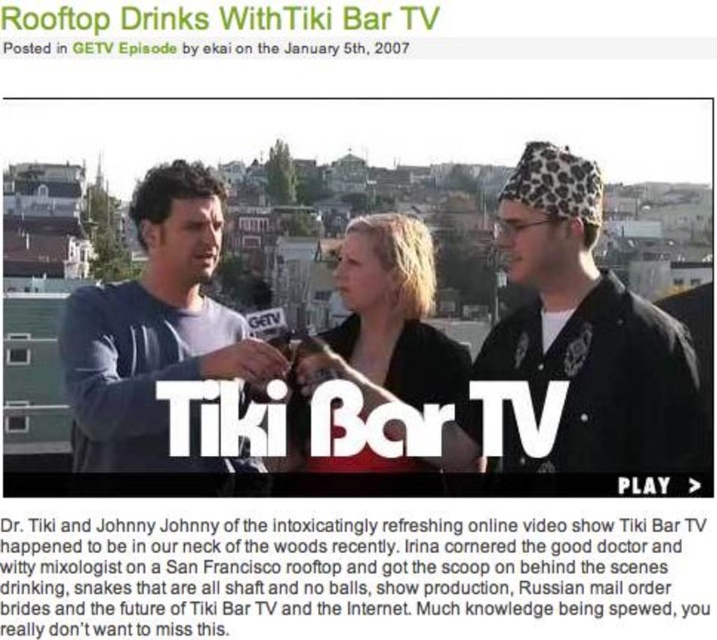
You are a photographer trying to capture a clear shot of the black paper text at center and the blonde hair at center. Which object should you zoom in on to ensure both are visible in the frame?

The black paper text at center is smaller than the blonde hair at center, so you should zoom in on the blonde hair at center to ensure both are visible in the frame.

What is the position of the black paper text at center in the image?

The black paper text at center is located at point 0.894 on the x axis and 0.490 on the y axis.